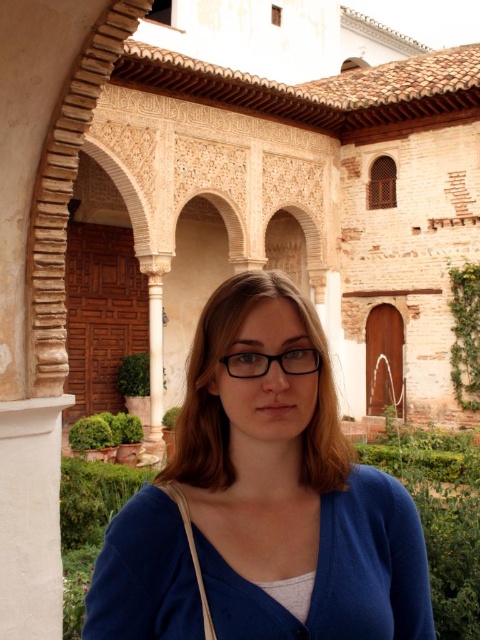
Question: Considering the relative positions of blue fabric at center and transparent plastic glasses at center in the image provided, where is blue fabric at center located with respect to transparent plastic glasses at center?

Choices:
 (A) above
 (B) below

Answer: (B)

Question: Which object appears farthest from the camera in this image?

Choices:
 (A) transparent plastic glasses at center
 (B) blue knitted sweater at center

Answer: (A)

Question: Which point is closer to the camera?

Choices:
 (A) (276, 568)
 (B) (228, 365)

Answer: (A)

Question: Can you confirm if blue knitted sweater at center is bigger than transparent plastic glasses at center?

Choices:
 (A) yes
 (B) no

Answer: (A)

Question: Is blue fabric at center positioned in front of transparent plastic glasses at center?

Choices:
 (A) yes
 (B) no

Answer: (A)

Question: Which of the following is the farthest from the observer?

Choices:
 (A) (291, 333)
 (B) (371, 625)
 (C) (243, 364)

Answer: (A)